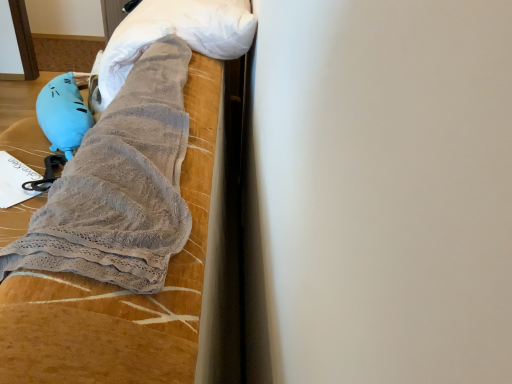
Question: Is velvet-like fabric bedspread at upper left completely or partially inside matte blue plush at left?

Choices:
 (A) yes
 (B) no

Answer: (B)

Question: From a real-world perspective, does matte blue plush at left stand above velvet-like fabric bedspread at upper left?

Choices:
 (A) no
 (B) yes

Answer: (B)

Question: Is matte blue plush at left next to velvet-like fabric bedspread at upper left?

Choices:
 (A) yes
 (B) no

Answer: (B)

Question: Considering the relative sizes of matte blue plush at left and velvet-like fabric bedspread at upper left in the image provided, is matte blue plush at left taller than velvet-like fabric bedspread at upper left?

Choices:
 (A) no
 (B) yes

Answer: (A)

Question: Does matte blue plush at left come behind velvet-like fabric bedspread at upper left?

Choices:
 (A) no
 (B) yes

Answer: (B)

Question: Looking at the image, does velvet-like fabric bedspread at upper left seem bigger or smaller compared to gray fuzzy towel at upper center?

Choices:
 (A) small
 (B) big

Answer: (B)

Question: Is velvet-like fabric bedspread at upper left inside the boundaries of gray fuzzy towel at upper center, or outside?

Choices:
 (A) outside
 (B) inside

Answer: (A)

Question: Is velvet-like fabric bedspread at upper left to the left or to the right of gray fuzzy towel at upper center in the image?

Choices:
 (A) right
 (B) left

Answer: (B)

Question: In terms of height, does velvet-like fabric bedspread at upper left look taller or shorter compared to gray fuzzy towel at upper center?

Choices:
 (A) short
 (B) tall

Answer: (B)

Question: Considering the positions of matte blue plush at left and gray fuzzy towel at upper center in the image, is matte blue plush at left bigger or smaller than gray fuzzy towel at upper center?

Choices:
 (A) small
 (B) big

Answer: (A)

Question: Is point (83, 129) positioned closer to the camera than point (239, 29)?

Choices:
 (A) closer
 (B) farther

Answer: (B)

Question: From a real-world perspective, is matte blue plush at left physically located above or below gray fuzzy towel at upper center?

Choices:
 (A) below
 (B) above

Answer: (A)

Question: From their relative heights in the image, would you say matte blue plush at left is taller or shorter than gray fuzzy towel at upper center?

Choices:
 (A) tall
 (B) short

Answer: (B)

Question: Is velvet-like fabric bedspread at upper left taller or shorter than matte blue plush at left?

Choices:
 (A) tall
 (B) short

Answer: (A)

Question: From a real-world perspective, is velvet-like fabric bedspread at upper left positioned above or below matte blue plush at left?

Choices:
 (A) above
 (B) below

Answer: (B)